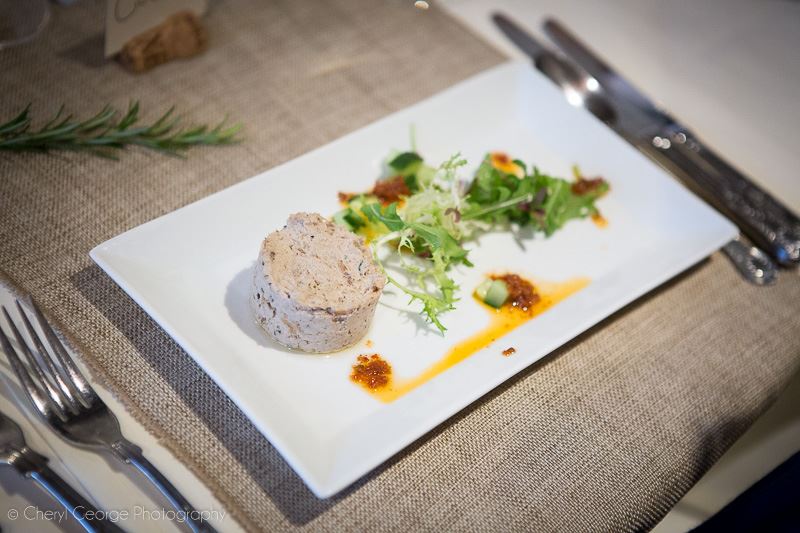
Identify the location of silver utensils. The width and height of the screenshot is (800, 533). (46, 480), (94, 416), (608, 112), (629, 115), (638, 100).